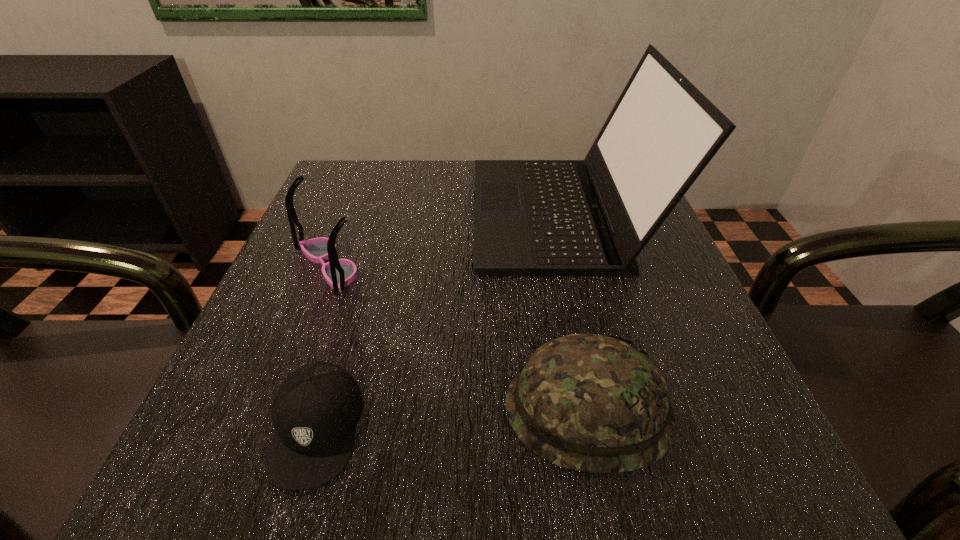
At what (x,y) coordinates should I click in order to perform the action: click on laptop. Please return your answer as a coordinate pair (x, y). This screenshot has width=960, height=540. Looking at the image, I should click on (592, 217).

Find the location of a particular element. The width and height of the screenshot is (960, 540). spectacles is located at coordinates click(x=338, y=273).

Where is `the taller cap`? This screenshot has width=960, height=540. the taller cap is located at coordinates (588, 402).

Locate an element on the screen. Image resolution: width=960 pixels, height=540 pixels. the second shortest object is located at coordinates (588, 402).

Where is `the shorter cap`? Image resolution: width=960 pixels, height=540 pixels. the shorter cap is located at coordinates (314, 413).

You are a GUI agent. You are given a task and a screenshot of the screen. Output one action in this format:
    pyautogui.click(x=<x>, y=<y>)
    Task: Click on the shortest object
    Image resolution: width=960 pixels, height=540 pixels.
    Given the screenshot: What is the action you would take?
    pyautogui.click(x=314, y=413)

In order to click on vacant space located 0.140m on the surface of the tallest object in this screenshot , I will do `click(409, 212)`.

This screenshot has height=540, width=960. I want to click on vacant space located on the surface of the tallest object, so pyautogui.click(x=409, y=212).

This screenshot has height=540, width=960. Find the location of `free space located 0.130m on the surface of the tallest object`. free space located 0.130m on the surface of the tallest object is located at coordinates (414, 212).

Locate an element on the screen. vacant space positioned on the right of the spectacles is located at coordinates [444, 265].